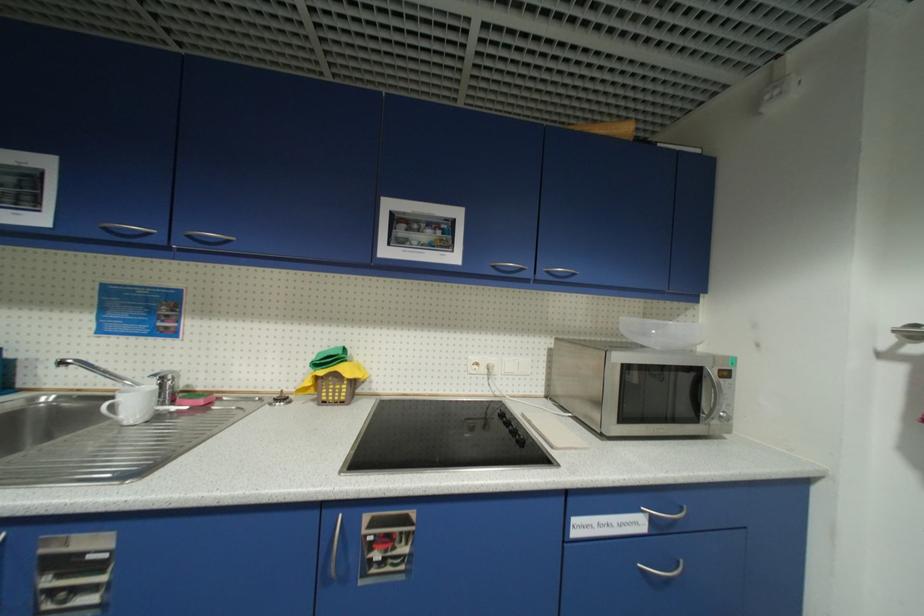
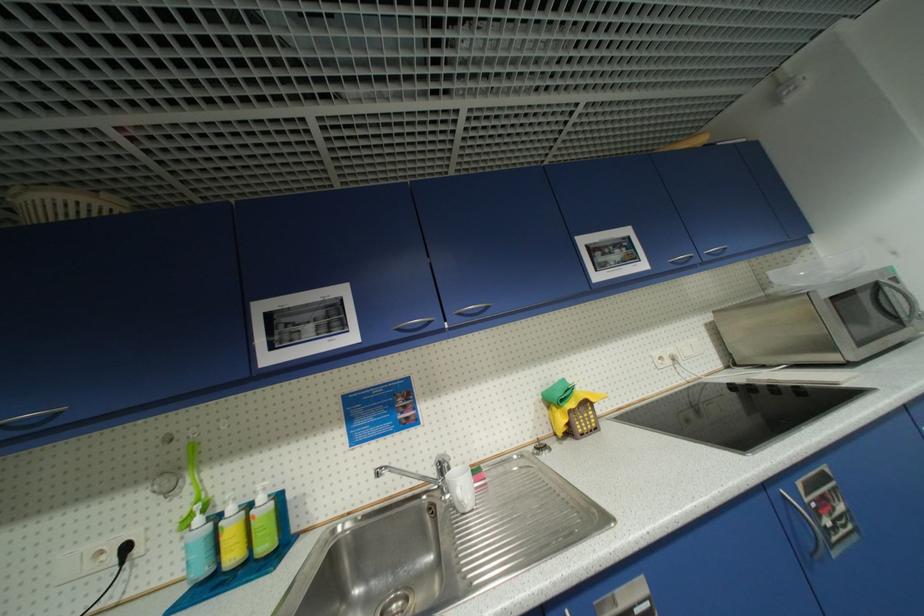
Where in the second image is the point corresponding to the point at 196,238 from the first image?

(466, 315)